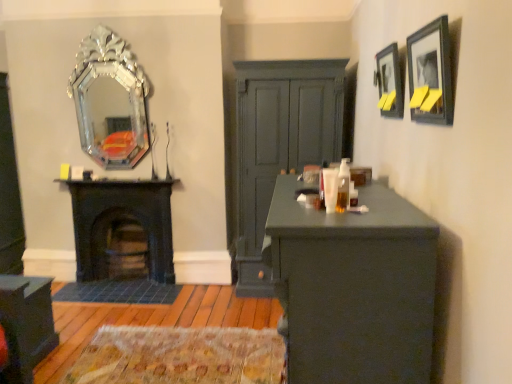
Image resolution: width=512 pixels, height=384 pixels. I want to click on vacant space in silver metallic mirror at upper left (from a real-world perspective), so click(x=118, y=173).